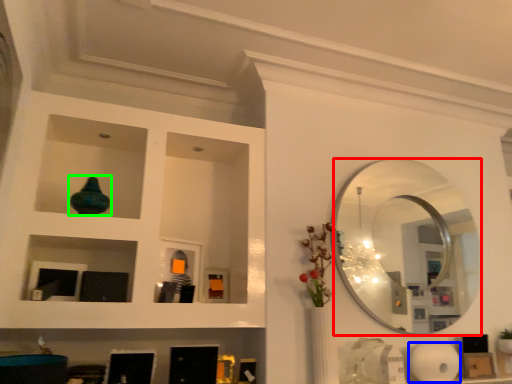
Question: Which object is the closest to the mirror (highlighted by a red box)? Choose among these: paper towel (highlighted by a blue box) or glass vase (highlighted by a green box).

Choices:
 (A) paper towel
 (B) glass vase

Answer: (A)